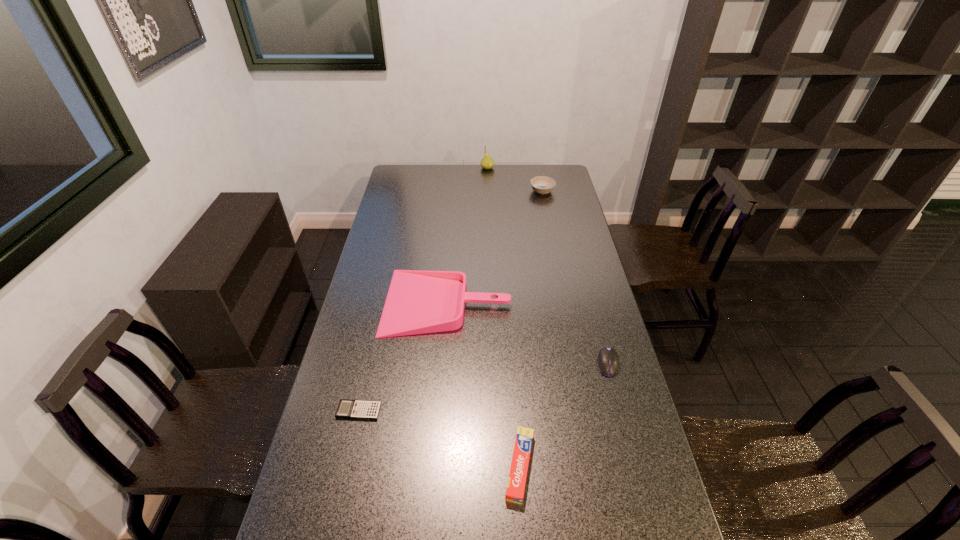
Locate an element on the screen. Image resolution: width=960 pixels, height=540 pixels. pear is located at coordinates (487, 162).

Where is `the tallest object`? This screenshot has height=540, width=960. the tallest object is located at coordinates (487, 162).

This screenshot has height=540, width=960. I want to click on bowl, so click(541, 184).

The height and width of the screenshot is (540, 960). I want to click on the fifth nearest object, so click(541, 184).

You are a GUI agent. You are given a task and a screenshot of the screen. Output one action in this format:
    pyautogui.click(x=<x>, y=<y>)
    Task: Click on the dustpan
    This screenshot has height=540, width=960.
    Given the screenshot: What is the action you would take?
    pyautogui.click(x=418, y=302)

The width and height of the screenshot is (960, 540). In order to click on the third nearest object in this screenshot , I will do `click(608, 360)`.

The image size is (960, 540). In order to click on the rightmost object in this screenshot , I will do `click(608, 360)`.

Find the location of a particular element. The width and height of the screenshot is (960, 540). toothpaste is located at coordinates (516, 483).

You are a GUI agent. You are given a task and a screenshot of the screen. Output one action in this format:
    pyautogui.click(x=<x>, y=<y>)
    Task: Click on the calculator
    
    Given the screenshot: What is the action you would take?
    pyautogui.click(x=354, y=409)

At what (x,y) coordinates should I click in order to perform the action: click on the shortest object. Please return your answer as a coordinate pair (x, y). The width and height of the screenshot is (960, 540). Looking at the image, I should click on (354, 409).